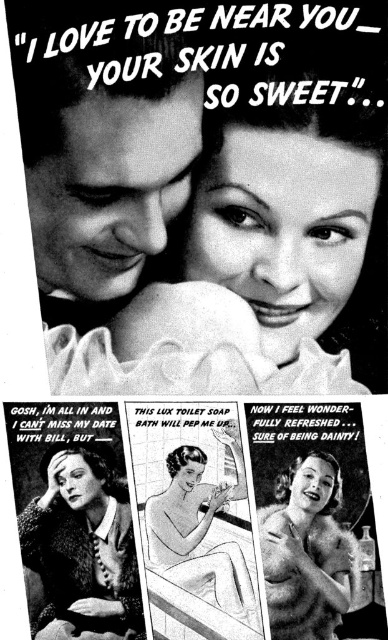
In the scene shown: Is smooth skin at upper center positioned behind knitted sweater at lower left?

No, it is not.

Who is positioned more to the left, smooth skin at upper center or knitted sweater at lower left?

From the viewer's perspective, knitted sweater at lower left appears more on the left side.

At what (x,y) coordinates should I click in order to perform the action: click on smooth skin at upper center. Please return your answer as a coordinate pair (x, y). The height and width of the screenshot is (640, 388). Looking at the image, I should click on (105, 168).

Describe the element at coordinates (83, 547) in the screenshot. This screenshot has height=640, width=388. I see `knitted sweater at lower left` at that location.

Does knitted sweater at lower left have a greater width compared to smooth porcelain soap at center?

Yes, knitted sweater at lower left is wider than smooth porcelain soap at center.

What do you see at coordinates (83, 547) in the screenshot?
I see `knitted sweater at lower left` at bounding box center [83, 547].

Identify the location of knitted sweater at lower left. (83, 547).

The width and height of the screenshot is (388, 640). What do you see at coordinates (83, 547) in the screenshot?
I see `knitted sweater at lower left` at bounding box center [83, 547].

Between point (138, 609) and point (346, 548), which one is positioned in front?

Point (346, 548)

Locate an element on the screen. knitted sweater at lower left is located at coordinates (83, 547).